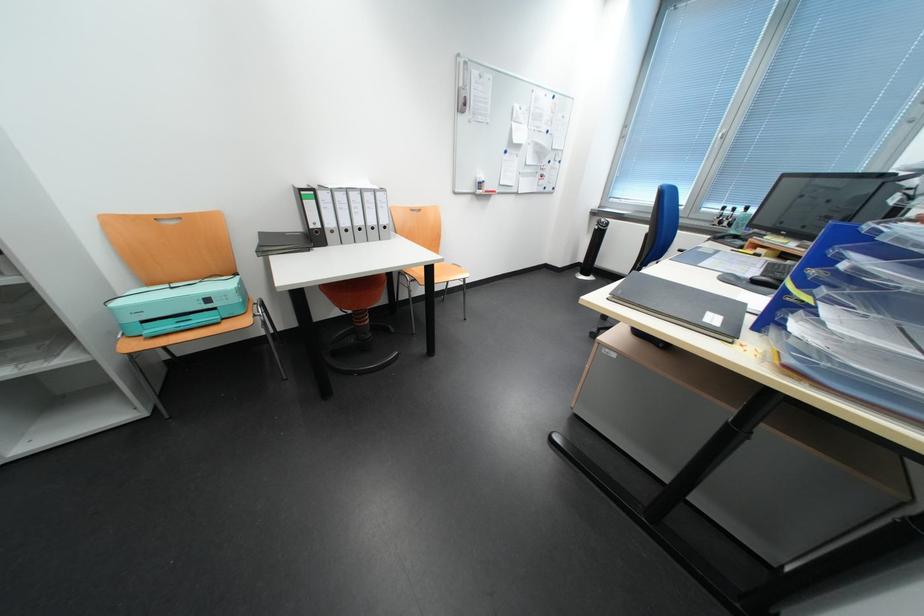
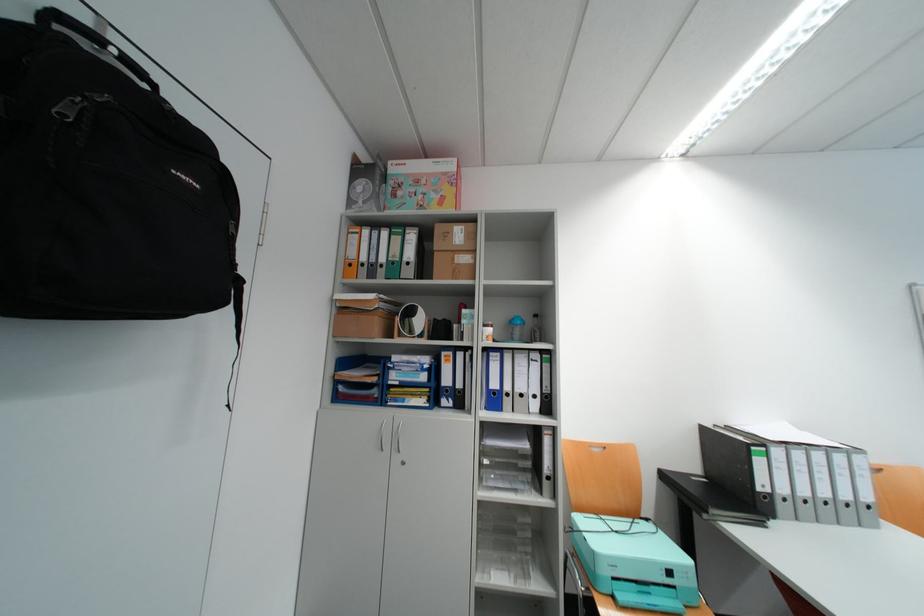
The point at (220,302) is marked in the first image. Where is the corresponding point in the second image?

(682, 573)